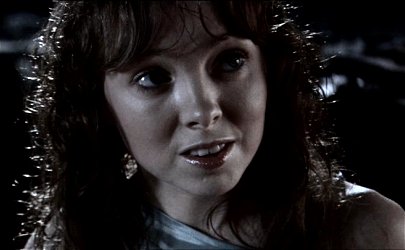
The width and height of the screenshot is (405, 250). In order to click on light in this screenshot , I will do `click(328, 86)`.